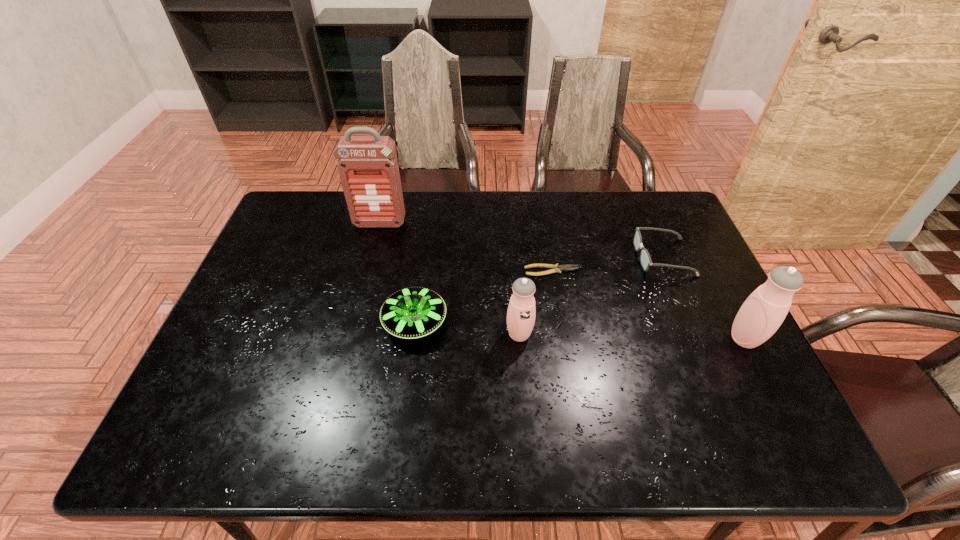
Identify the location of free space that satisfies the following two spatial constraints: 1. on the front side of the third shortest object; 2. on the right side of the shorter thermos bottle. The image size is (960, 540). (414, 334).

Identify the location of free location that satisfies the following two spatial constraints: 1. on the face of the taller thermos bottle; 2. on the right side of the spectacles. (697, 339).